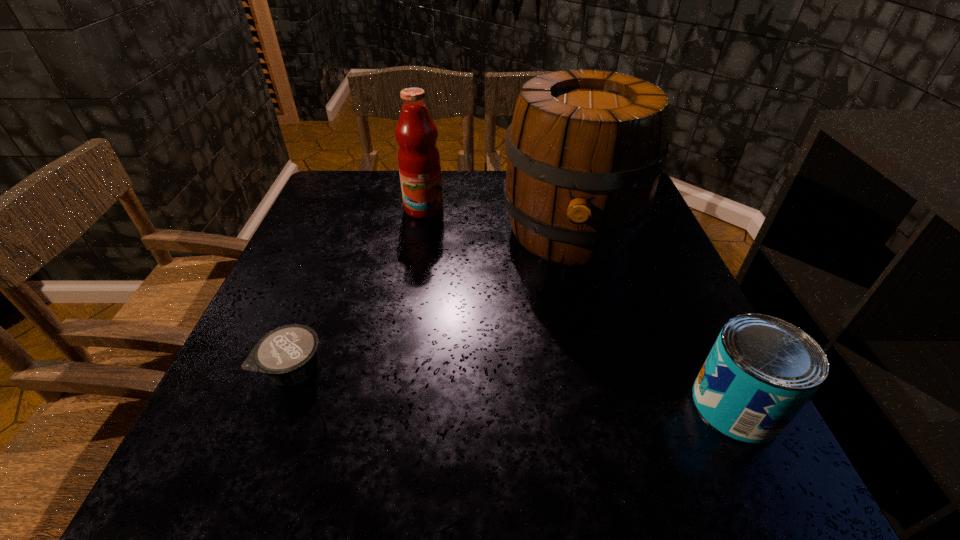
You are a GUI agent. You are given a task and a screenshot of the screen. Output one action in this format:
    pyautogui.click(x=<x>, y=<y>)
    Task: Click on the vacant space located 0.180m on the side of the cider where the spigot is located
    The image size is (960, 540).
    Given the screenshot: What is the action you would take?
    pyautogui.click(x=566, y=342)

You are a GUI agent. You are given a task and a screenshot of the screen. Output one action in this format:
    pyautogui.click(x=<x>, y=<y>)
    Task: Click on the vacant position located on the side of the cider where the spigot is located
    This screenshot has width=960, height=540.
    Given the screenshot: What is the action you would take?
    pyautogui.click(x=564, y=386)

The height and width of the screenshot is (540, 960). In order to click on vacant area located on the side of the cider where the spigot is located in this screenshot , I will do `click(564, 406)`.

At what (x,y) coordinates should I click in order to perform the action: click on fruit juice positioned at the far edge. Please return your answer as a coordinate pair (x, y). This screenshot has width=960, height=540. Looking at the image, I should click on (419, 165).

I want to click on cider that is at the far edge, so click(585, 149).

The height and width of the screenshot is (540, 960). I want to click on yogurt located at the near edge, so click(288, 355).

Identify the location of can that is at the near edge. (761, 371).

Identify the location of object situated at the left edge. (288, 355).

Locate an element on the screen. can that is positioned at the right edge is located at coordinates (761, 371).

At what (x,y) coordinates should I click in order to perform the action: click on cider located at the right edge. Please return your answer as a coordinate pair (x, y). This screenshot has width=960, height=540. Looking at the image, I should click on (585, 149).